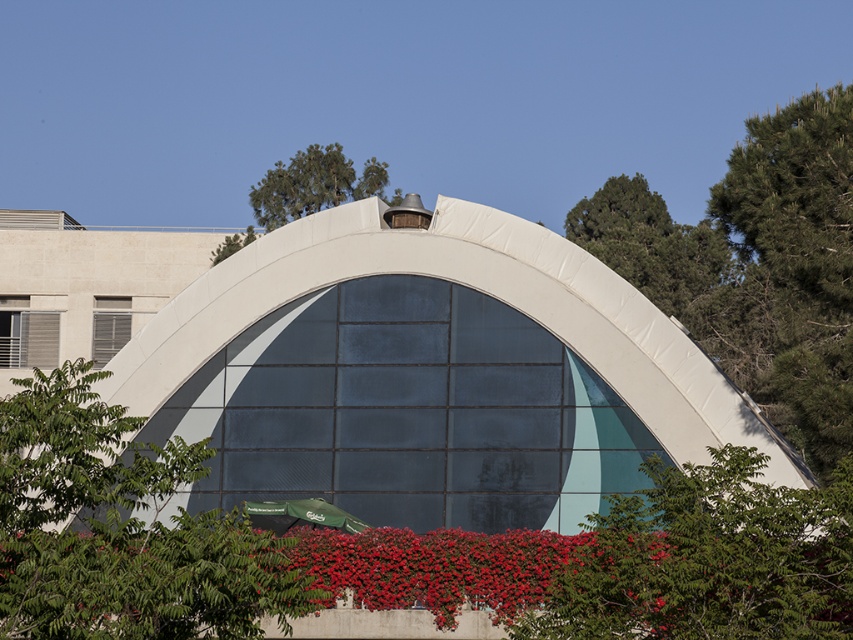
Can you confirm if green leafy tree at lower left is shorter than white mesh window at left?

Incorrect, green leafy tree at lower left's height does not fall short of white mesh window at left's.

Measure the distance between point (126, 556) and camera.

The distance of point (126, 556) from camera is 51.24 feet.

Where is `green leafy tree at lower left`? green leafy tree at lower left is located at coordinates (120, 529).

The width and height of the screenshot is (853, 640). Describe the element at coordinates (440, 568) in the screenshot. I see `vibrant red petals at lower center` at that location.

The height and width of the screenshot is (640, 853). Describe the element at coordinates (440, 568) in the screenshot. I see `vibrant red petals at lower center` at that location.

Image resolution: width=853 pixels, height=640 pixels. I want to click on vibrant red petals at lower center, so click(440, 568).

Measure the distance between point (283, 186) and camera.

They are 223.22 feet apart.

Is point (245, 230) behind point (39, 346)?

Yes, it is.

Image resolution: width=853 pixels, height=640 pixels. What do you see at coordinates (314, 184) in the screenshot?
I see `green leafy tree at upper center` at bounding box center [314, 184].

The height and width of the screenshot is (640, 853). Identify the location of green leafy tree at upper center. (314, 184).